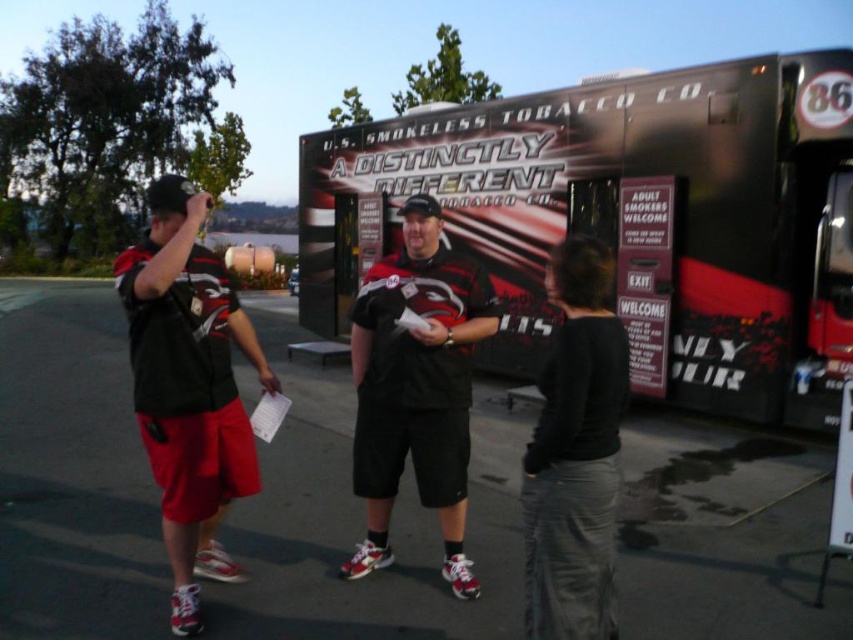
Question: Which object is the farthest from the black matte shirt at center?

Choices:
 (A) matte black shirt at center
 (B) matte black t-shirt at left

Answer: (B)

Question: Which of these objects is positioned closest to the black matte shirt at center?

Choices:
 (A) matte black shirt at center
 (B) metallic silver food truck at center

Answer: (A)

Question: Is matte black shirt at center above black matte shirt at center?

Choices:
 (A) no
 (B) yes

Answer: (B)

Question: Can you confirm if matte black t-shirt at left is positioned to the left of matte black shirt at center?

Choices:
 (A) no
 (B) yes

Answer: (B)

Question: Estimate the real-world distances between objects in this image. Which object is farther from the matte black t-shirt at left?

Choices:
 (A) matte black shirt at center
 (B) metallic silver food truck at center
 (C) black matte shirt at center

Answer: (B)

Question: Is matte black t-shirt at left to the left of matte black shirt at center from the viewer's perspective?

Choices:
 (A) yes
 (B) no

Answer: (A)